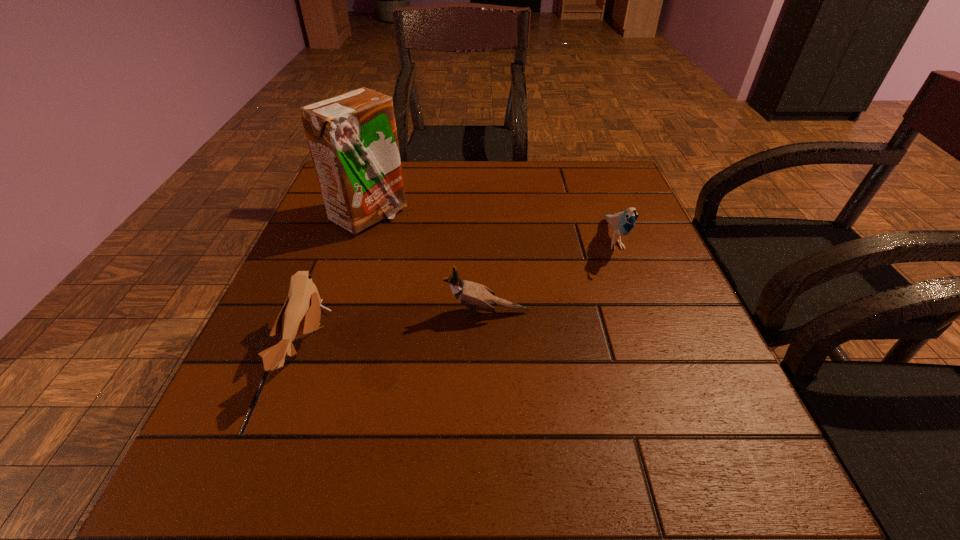
Locate an element on the screen. The image size is (960, 540). free space located 0.160m at the beak of the leftmost bird is located at coordinates (416, 347).

This screenshot has height=540, width=960. Identify the location of object present at the far edge. (352, 137).

Where is `carton situated at the left edge`? The width and height of the screenshot is (960, 540). carton situated at the left edge is located at coordinates (352, 137).

I want to click on bird situated at the left edge, so click(x=301, y=313).

In order to click on object that is positioned at the right edge in this screenshot , I will do `click(622, 223)`.

Where is `object positioned at the far left corner`? The height and width of the screenshot is (540, 960). object positioned at the far left corner is located at coordinates (352, 137).

The width and height of the screenshot is (960, 540). What are the coordinates of `free region at the far edge` in the screenshot? It's located at (415, 177).

What are the coordinates of `free region at the left edge of the desktop` in the screenshot? It's located at (212, 442).

The image size is (960, 540). What are the coordinates of `free spot at the right edge of the desktop` in the screenshot? It's located at (644, 246).

Locate an element on the screen. vacant space at the near left corner of the desktop is located at coordinates (231, 501).